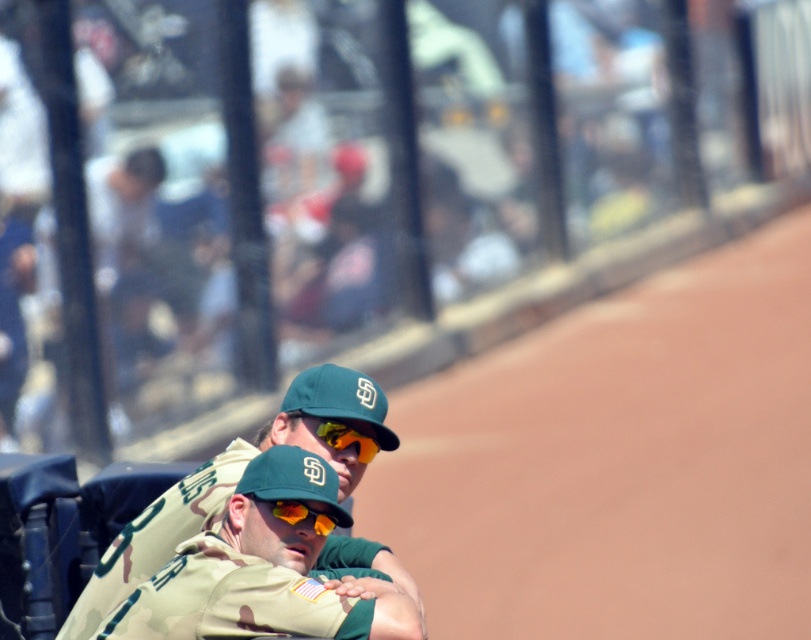
You are a photographer trying to capture a closeup of the camouflage uniform at center and the shiny orange goggles at center. Since both are at center, which one is more to the left?

The camouflage uniform at center is positioned on the left side of shiny orange goggles at center, so it is more to the left.